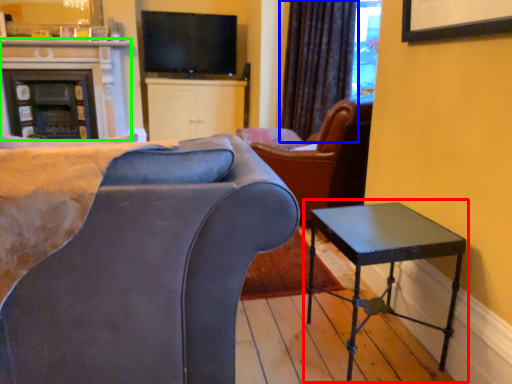
Question: Based on their relative distances, which object is farther from table (highlighted by a red box)? Choose from curtain (highlighted by a blue box) and fireplace (highlighted by a green box).

Choices:
 (A) curtain
 (B) fireplace

Answer: (B)